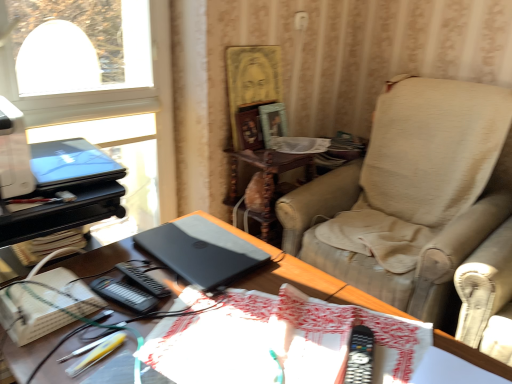
Identify the location of free space to the left of black plastic remote control at lower right. (281, 353).